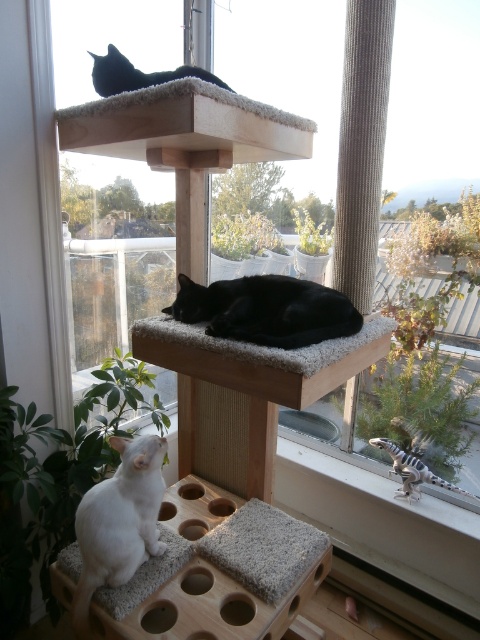
Between point (146, 451) and point (127, 83), which one is positioned behind?

Point (127, 83)

Identify the location of white fluffy cat at lower left. This screenshot has height=640, width=480. (119, 522).

Can you confirm if black fur cat at center is positioned to the right of black fur cat at upper center?

Correct, you'll find black fur cat at center to the right of black fur cat at upper center.

Does black fur cat at center come in front of black fur cat at upper center?

Yes, black fur cat at center is in front of black fur cat at upper center.

This screenshot has width=480, height=640. What do you see at coordinates (266, 308) in the screenshot?
I see `black fur cat at center` at bounding box center [266, 308].

In order to click on black fur cat at center in this screenshot , I will do `click(266, 308)`.

Which is more to the right, white fluffy cat at lower left or black fur cat at center?

Positioned to the right is black fur cat at center.

Is white fluffy cat at lower left above black fur cat at center?

No, white fluffy cat at lower left is not above black fur cat at center.

Find the location of a particular element. The width and height of the screenshot is (480, 640). white fluffy cat at lower left is located at coordinates (119, 522).